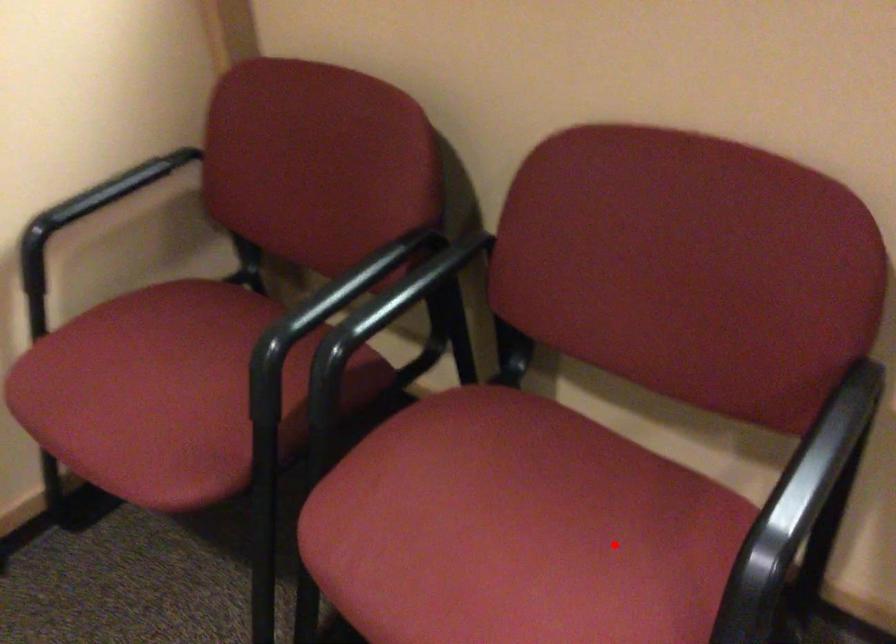
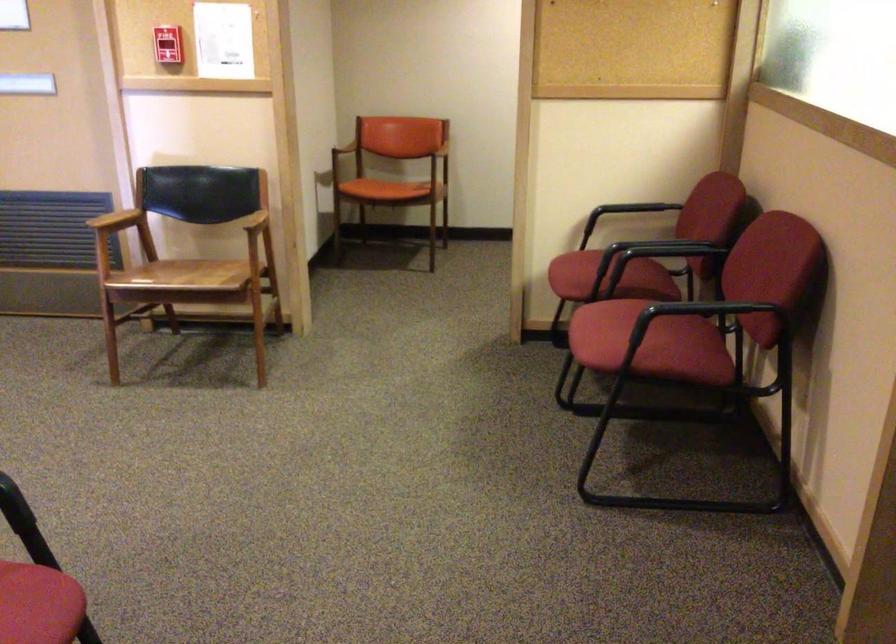
Locate, in the second image, the point that corresponds to the highlighted location in the first image.

(650, 343)